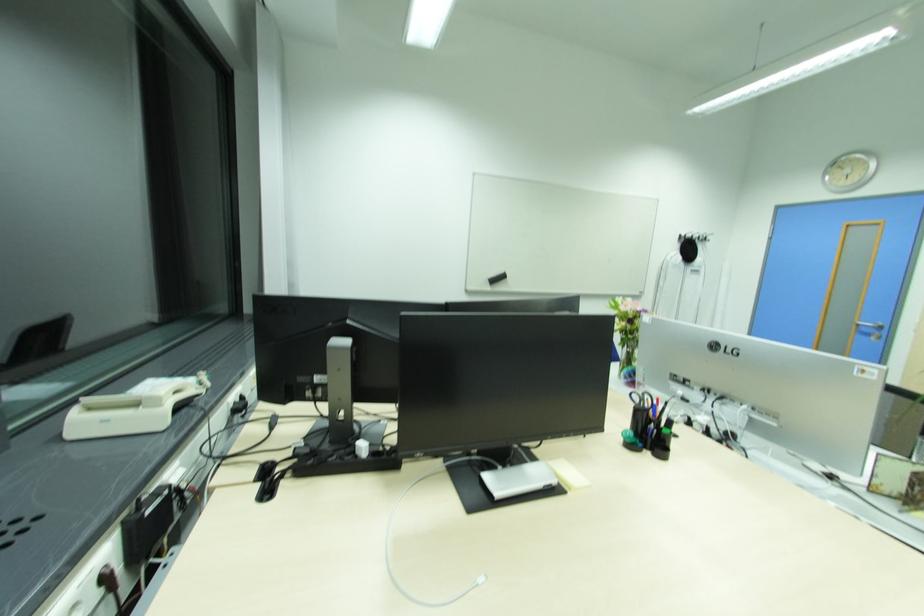
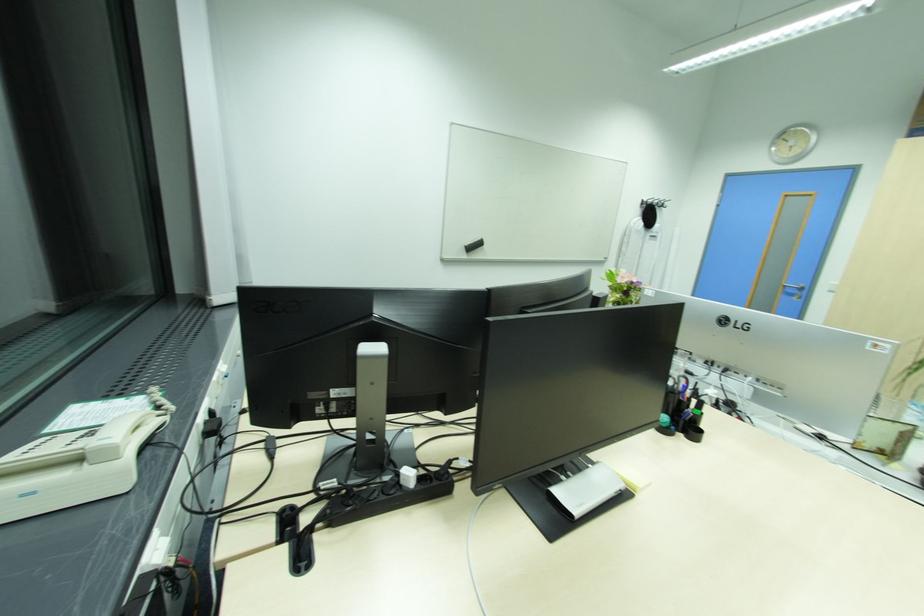
Find the pixel in the second image that matches point (637, 321) in the first image.

(630, 293)